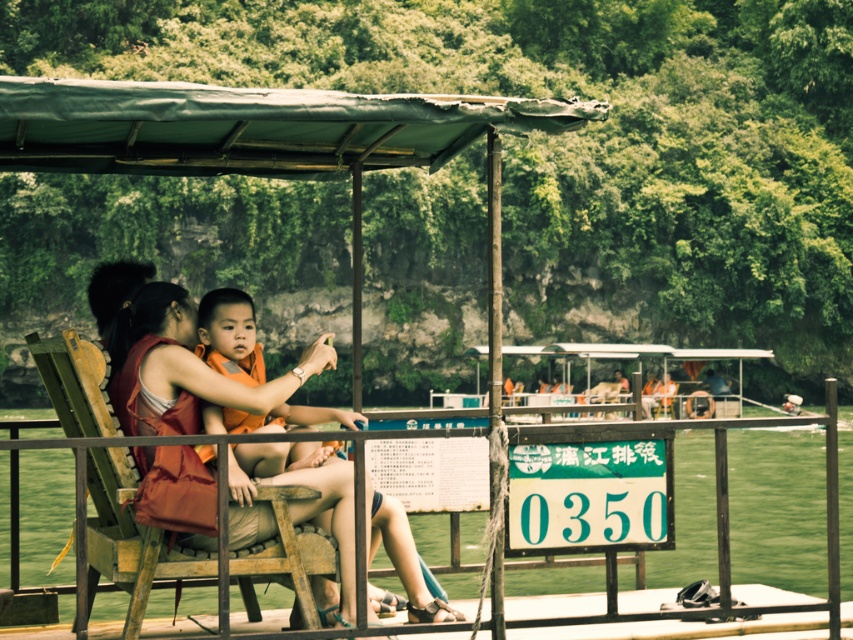
Question: Which point appears farthest from the camera in this image?

Choices:
 (A) (251, 369)
 (B) (4, 156)

Answer: (B)

Question: Considering the real-world distances, which object is farthest from the wooden chair at center?

Choices:
 (A) matte red life vest at center
 (B) orange fabric child at center
 (C) orange fabric life jacket at center
 (D) green fabric canopy at upper center

Answer: (D)

Question: Is green fabric canopy at upper center wider than wooden chair at center?

Choices:
 (A) no
 (B) yes

Answer: (B)

Question: Observing the image, what is the correct spatial positioning of green fabric canopy at upper center in reference to wooden chair at center?

Choices:
 (A) right
 (B) left

Answer: (B)

Question: Which point appears farthest from the camera in this image?

Choices:
 (A) (94, 541)
 (B) (221, 144)
 (C) (262, 358)

Answer: (B)

Question: Is green fabric canopy at upper center thinner than matte red life vest at center?

Choices:
 (A) no
 (B) yes

Answer: (A)